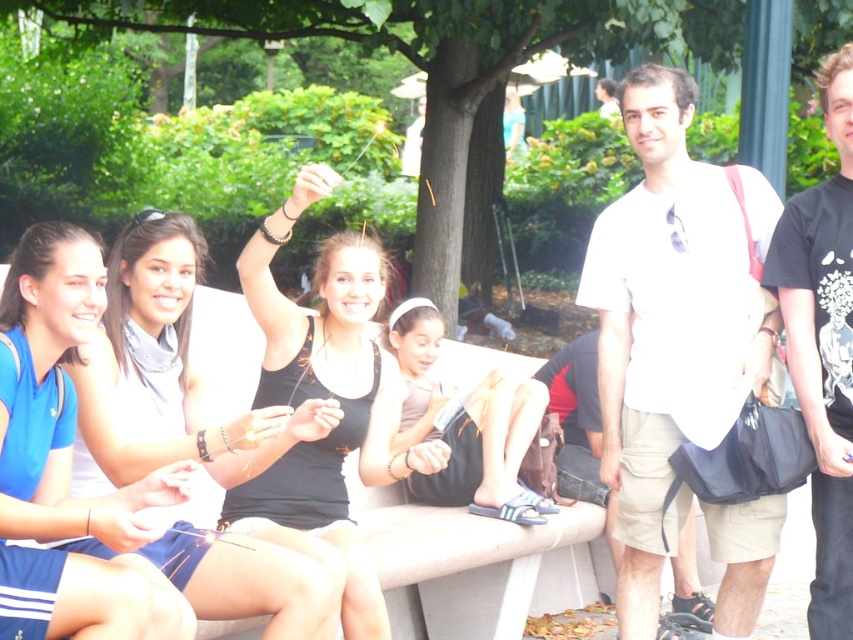
Can you confirm if white cotton shirt at center is thinner than white cotton shirt at upper center?

No, white cotton shirt at center is not thinner than white cotton shirt at upper center.

Which is behind, point (677, 396) or point (604, 104)?

Point (604, 104)

Between point (635, 536) and point (608, 108), which one is positioned in front?

Point (635, 536) is in front.

Identify the location of white cotton shirt at center. Image resolution: width=853 pixels, height=640 pixels. (670, 320).

Can you confirm if black cotton t-shirt at center is wider than white cotton shirt at upper center?

Incorrect, black cotton t-shirt at center's width does not surpass white cotton shirt at upper center's.

Between black cotton t-shirt at center and white cotton shirt at upper center, which one appears on the left side from the viewer's perspective?

Positioned to the left is black cotton t-shirt at center.

Identify the location of black cotton t-shirt at center. Image resolution: width=853 pixels, height=640 pixels. (822, 346).

The height and width of the screenshot is (640, 853). In order to click on black cotton t-shirt at center in this screenshot , I will do `click(822, 346)`.

Which is in front, point (761, 600) or point (822, 92)?

Positioned in front is point (822, 92).

Looking at this image, does white cotton shirt at center lie in front of black cotton t-shirt at center?

No, it is not.

Does point (730, 580) lie in front of point (836, 65)?

No, (730, 580) is further to viewer.

Locate an element on the screen. The image size is (853, 640). white cotton shirt at center is located at coordinates (670, 320).